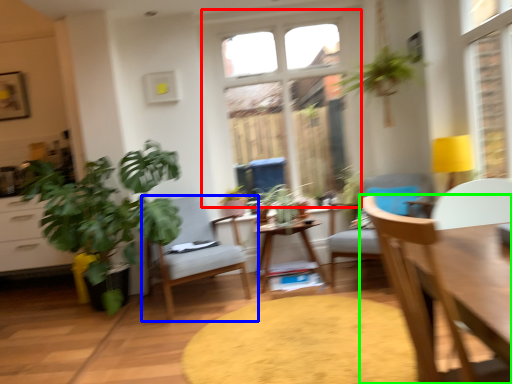
Question: Which is farther away from window (highlighted by a red box)? chair (highlighted by a blue box) or chair (highlighted by a green box)?

Choices:
 (A) chair
 (B) chair

Answer: (B)